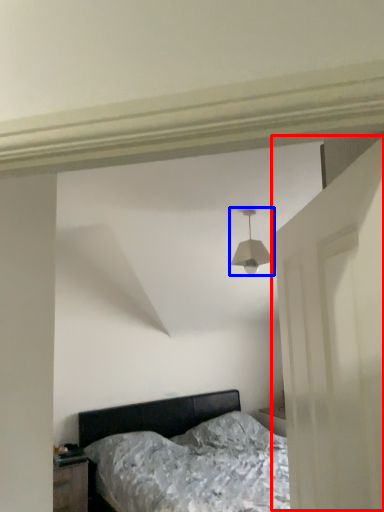
Question: Among these objects, which one is farthest to the camera, door (highlighted by a red box) or lamp (highlighted by a blue box)?

Choices:
 (A) door
 (B) lamp

Answer: (B)